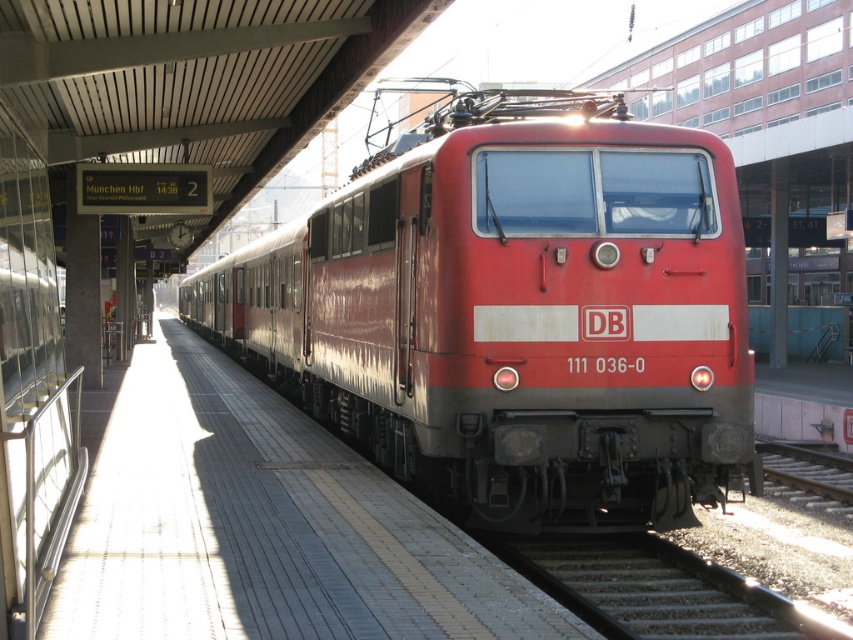
Question: Which of the following is the farthest from the observer?

Choices:
 (A) matte red train at center
 (B) brick platform at center
 (C) gray gravel train track at lower center

Answer: (A)

Question: Does matte red train at center appear on the left side of gray gravel train track at lower center?

Choices:
 (A) no
 (B) yes

Answer: (B)

Question: Which of the following is the closest to the observer?

Choices:
 (A) (242, 492)
 (B) (741, 428)

Answer: (B)

Question: Does matte red train at center appear under brick platform at center?

Choices:
 (A) yes
 (B) no

Answer: (B)

Question: Which point appears farthest from the camera in this image?

Choices:
 (A) (694, 632)
 (B) (585, 630)

Answer: (A)

Question: Does matte red train at center appear on the right side of brick platform at center?

Choices:
 (A) yes
 (B) no

Answer: (B)